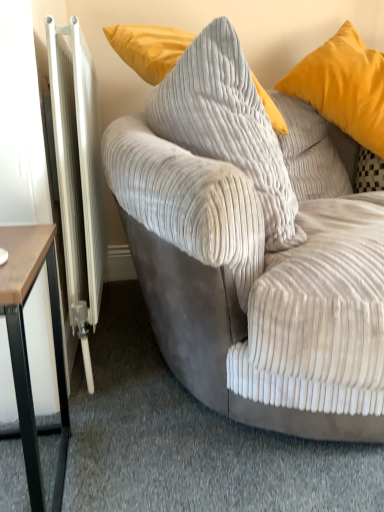
Question: Is point (213, 122) closer or farther from the camera than point (322, 53)?

Choices:
 (A) closer
 (B) farther

Answer: (A)

Question: In the image, is corduroy pillow at center, acting as the first pillow starting from the left, positioned in front of or behind matte yellow pillow at upper right, positioned as the 2th pillow in left-to-right order?

Choices:
 (A) behind
 (B) front

Answer: (B)

Question: Which object is the farthest from the corduroy pillow at center, acting as the first pillow starting from the left?

Choices:
 (A) brown wood table at left
 (B) matte yellow pillow at upper right, which appears as the first pillow when viewed from the right
 (C) white metallic radiator at left
 (D) velvet gray couch at center

Answer: (B)

Question: Which object is the farthest from the white metallic radiator at left?

Choices:
 (A) matte yellow pillow at upper right, positioned as the 2th pillow in left-to-right order
 (B) velvet gray couch at center
 (C) corduroy pillow at center, which is the 2th pillow in right-to-left order
 (D) brown wood table at left

Answer: (A)